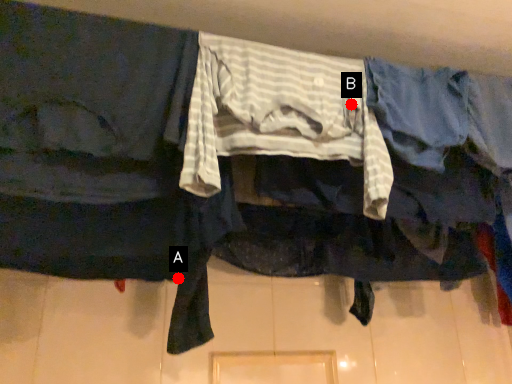
Question: Two points are circled on the image, labeled by A and B beside each circle. Which point is closer to the camera taking this photo?

Choices:
 (A) A is closer
 (B) B is closer

Answer: (B)